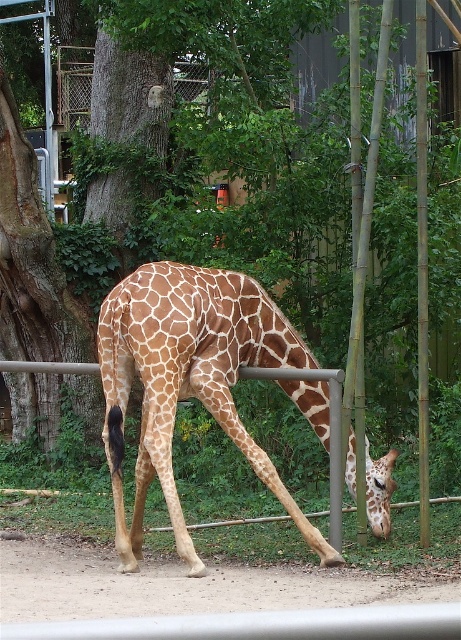
Can you confirm if brown spotted giraffe at center is positioned above brown textured giraffe head at center?

Indeed, brown spotted giraffe at center is positioned over brown textured giraffe head at center.

Which is in front, point (217, 358) or point (384, 525)?

Point (217, 358) is more forward.

This screenshot has height=640, width=461. What are the coordinates of `brown spotted giraffe at center` in the screenshot? It's located at (189, 381).

Is point (224, 45) positioned behind point (348, 476)?

Yes, point (224, 45) is behind point (348, 476).

Is point (169, 44) farther from viewer compared to point (385, 509)?

Yes.

The height and width of the screenshot is (640, 461). I want to click on brown textured tree at center, so click(x=218, y=29).

You are a GUI agent. You are given a task and a screenshot of the screen. Output one action in this format:
    pyautogui.click(x=<x>, y=<y>)
    Task: Click on the brown spotted giraffe at center
    This screenshot has width=461, height=640.
    Given the screenshot: What is the action you would take?
    pyautogui.click(x=189, y=381)

Does brown spotted giraffe at center appear on the right side of brown textured tree at center?

Incorrect, brown spotted giraffe at center is not on the right side of brown textured tree at center.

Does point (137, 465) come behind point (225, 145)?

No, it is not.

Where is `brown spotted giraffe at center`? The height and width of the screenshot is (640, 461). brown spotted giraffe at center is located at coordinates (189, 381).